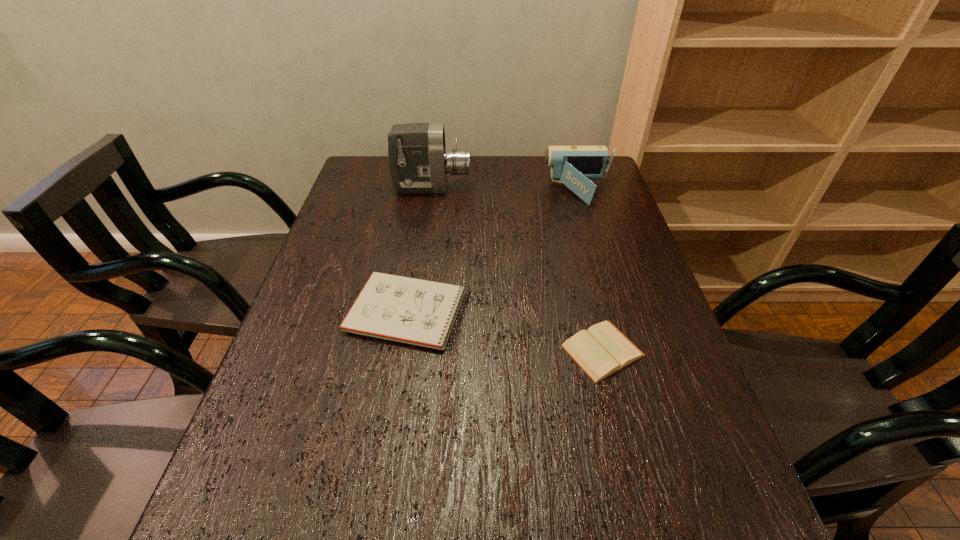
The width and height of the screenshot is (960, 540). I want to click on empty space that is in between the diary and the shorter camcorder, so click(x=590, y=271).

Locate an element on the screen. This screenshot has width=960, height=540. the second closest object relative to the tallest object is located at coordinates (415, 311).

Locate which object is the second closest to the taller camcorder. Please provide its 2D coordinates. Your answer should be formatted as a tuple, i.e. [(x, y)], where the tuple contains the x and y coordinates of a point satisfying the conditions above.

[(415, 311)]

The height and width of the screenshot is (540, 960). I want to click on vacant area that satisfies the following two spatial constraints: 1. on the back side of the diary; 2. at the front of the tallest object, highlighting the lens, so click(x=562, y=188).

Image resolution: width=960 pixels, height=540 pixels. I want to click on vacant space that satisfies the following two spatial constraints: 1. on the front side of the notepad; 2. on the right side of the diary, so click(403, 350).

The image size is (960, 540). I want to click on free space that satisfies the following two spatial constraints: 1. at the front of the taller camcorder, highlighting the lens; 2. on the left side of the diary, so click(x=408, y=350).

Identify the location of free space that satisfies the following two spatial constraints: 1. on the back side of the diary; 2. at the front of the taller camcorder, highlighting the lens. The image size is (960, 540). (562, 188).

The image size is (960, 540). What are the coordinates of `vacant region that satisfies the following two spatial constraints: 1. on the side of the second tallest object with the flip-out screen; 2. on the front side of the third tallest object` in the screenshot? It's located at (615, 312).